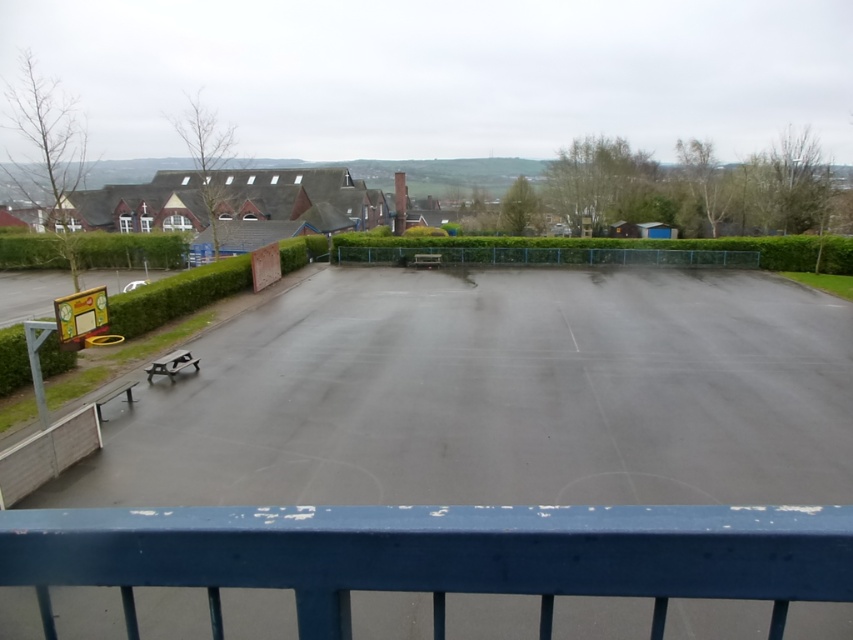
You are standing at the point marked as point (x=460, y=456) on the basketball court. What type of surface are you currently standing on?

You are standing on a smooth asphalt skate park at center.

You are standing on the smooth blue railing at center and want to roll a marble towards the smooth asphalt skate park at center. Which direction should you roll the marble to reach the skate park?

The smooth asphalt skate park at center is located above the smooth blue railing at center, so you should roll the marble upward to reach the skate park.

You are a skateboarder trying to jump from the smooth asphalt skate park at center to the green leafy hedge at left. Based on their heights, will you be able to land safely on the hedge?

The smooth asphalt skate park at center is much taller than the green leafy hedge at left, so jumping from the higher skate park to the lower hedge might result in a hard landing. Consider checking the height difference before attempting the jump.